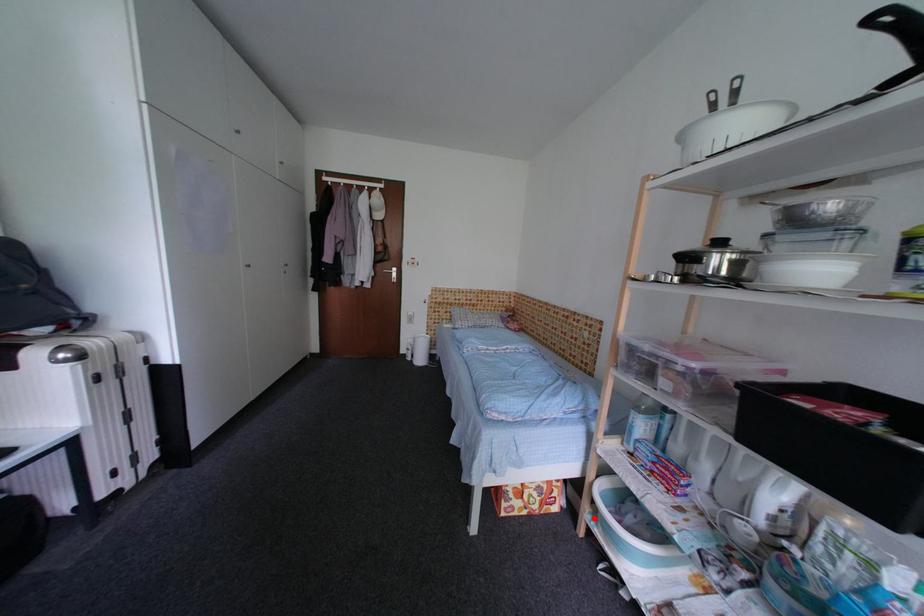
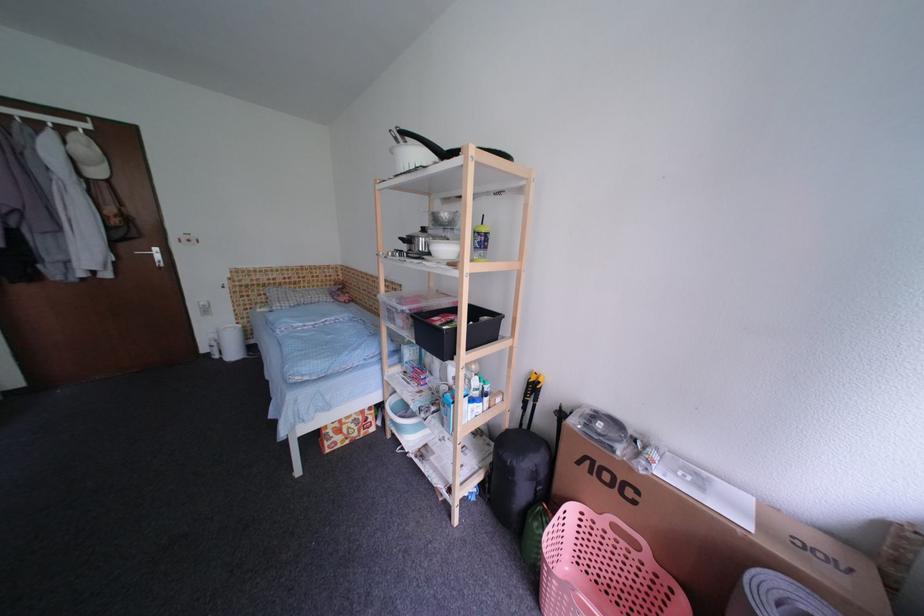
Question: I am providing you with two images of the same scene from different viewpoints. Given a red point in image1, look at the same physical point in image2. Is it:

Choices:
 (A) Closer to the viewpoint
 (B) Farther from the viewpoint

Answer: (B)